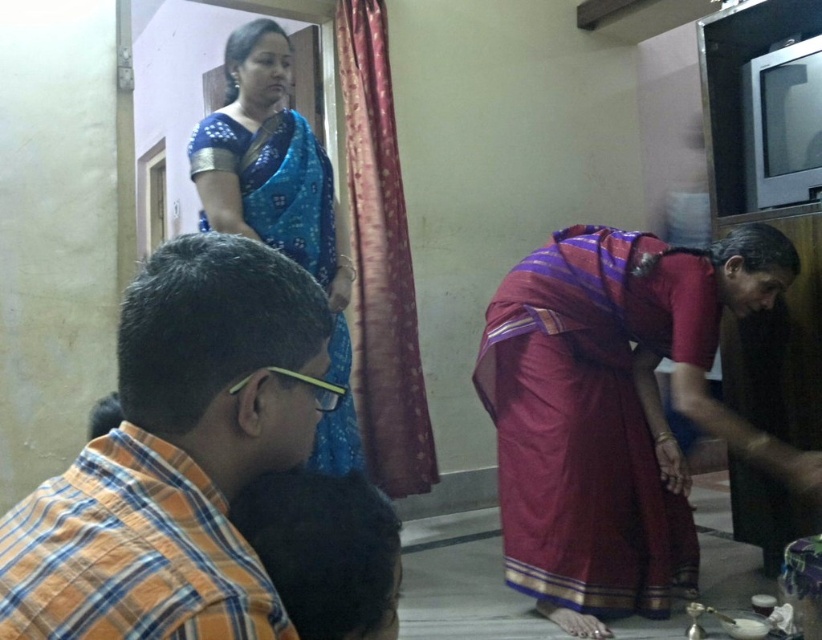
Does point (603, 257) come behind point (169, 637)?

Yes, it is.

Who is more forward, (x=590, y=509) or (x=67, y=506)?

Point (x=67, y=506) is more forward.

Describe the element at coordinates (590, 419) in the screenshot. The image size is (822, 640). I see `maroon silk saree at lower center` at that location.

Locate an element on the screen. Image resolution: width=822 pixels, height=640 pixels. maroon silk saree at lower center is located at coordinates (590, 419).

Is maroon silk saree at lower center smaller than blue silk saree at upper left?

No, maroon silk saree at lower center is not smaller than blue silk saree at upper left.

Find the location of a particular element. maroon silk saree at lower center is located at coordinates (590, 419).

Between orange plaid shirt at lower left and blue silk saree at upper left, which one appears on the right side from the viewer's perspective?

Positioned to the right is orange plaid shirt at lower left.

Is point (231, 353) farther from viewer compared to point (227, 134)?

No.

You are a GUI agent. You are given a task and a screenshot of the screen. Output one action in this format:
    pyautogui.click(x=<x>, y=<y>)
    Task: Click on the orange plaid shirt at lower left
    The height and width of the screenshot is (640, 822).
    Given the screenshot: What is the action you would take?
    178,456